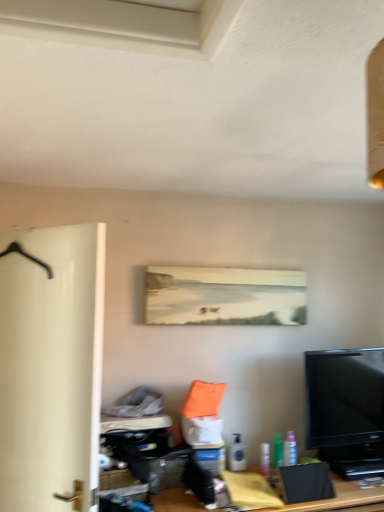
Where is `vacant region to the left of pink plastic spray bottle at lower right, positioned as the first toiletry in right-to-left order`? This screenshot has height=512, width=384. vacant region to the left of pink plastic spray bottle at lower right, positioned as the first toiletry in right-to-left order is located at coordinates (253, 472).